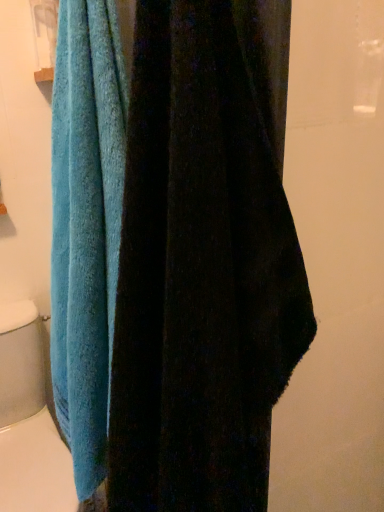
Question: Should I look upward or downward to see blue terry cloth towel at left?

Choices:
 (A) up
 (B) down

Answer: (B)